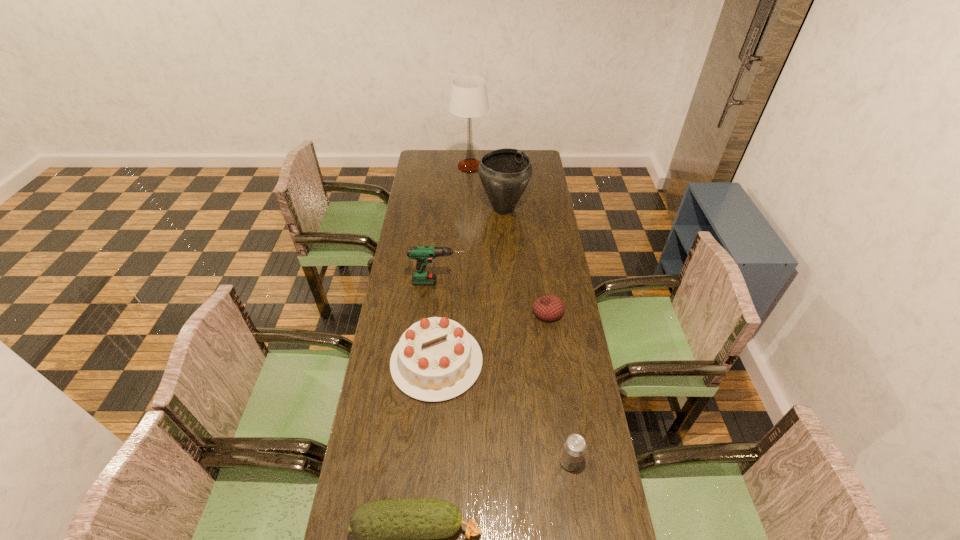
Locate an element on the screen. This screenshot has height=540, width=960. birthday cake that is positioned at the left edge is located at coordinates (436, 359).

I want to click on urn situated at the right edge, so click(x=505, y=173).

Locate an element on the screen. The width and height of the screenshot is (960, 540). beer can at the right edge is located at coordinates (574, 448).

Image resolution: width=960 pixels, height=540 pixels. I want to click on beanbag at the right edge, so click(548, 308).

At what (x,y) coordinates should I click in order to perform the action: click on vacant space at the left edge. Please return your answer as a coordinate pair (x, y). Looking at the image, I should click on (438, 198).

The image size is (960, 540). In order to click on free space at the right edge in this screenshot , I will do `click(547, 245)`.

In the image, there is a desktop. Identify the location of vacant area at the far left corner. (420, 172).

At what (x,y) coordinates should I click in order to perform the action: click on vacant space at the far right corner. Please return your answer as a coordinate pair (x, y). The width and height of the screenshot is (960, 540). Looking at the image, I should click on (532, 154).

The height and width of the screenshot is (540, 960). I want to click on vacant point located between the beanbag and the fourth shortest object, so click(x=492, y=337).

Locate an element on the screen. The width and height of the screenshot is (960, 540). free spot between the fifth tallest object and the birthday cake is located at coordinates (503, 411).